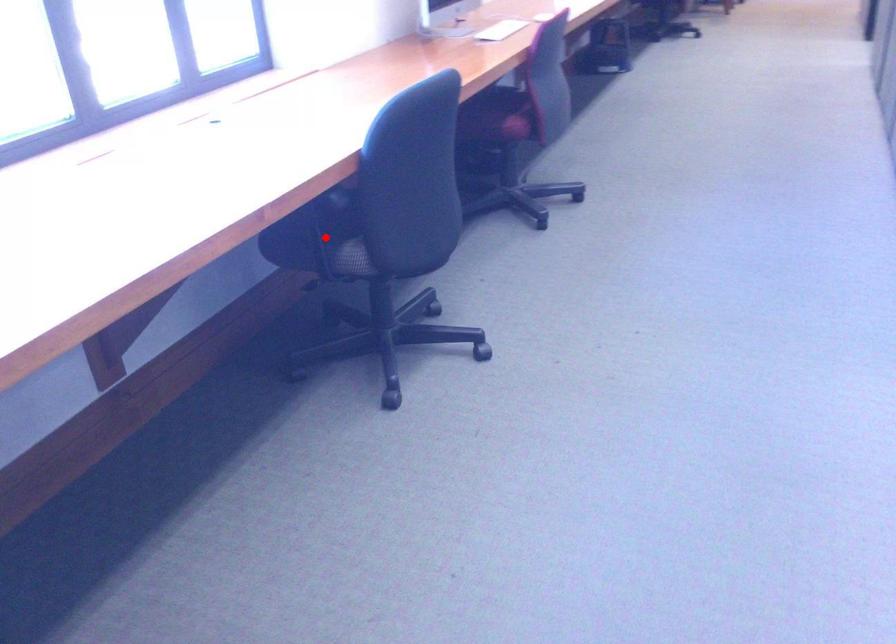
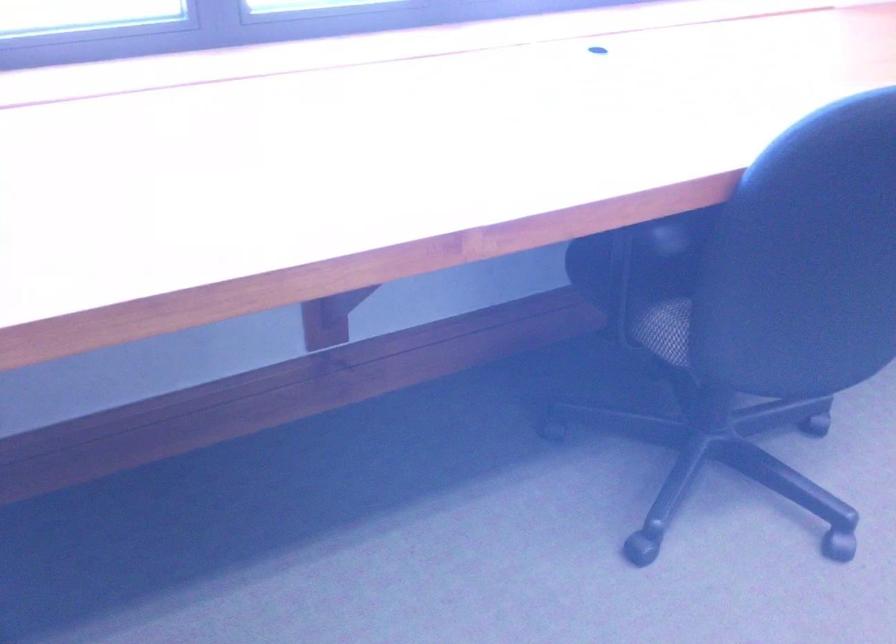
Locate, in the second image, the point that corresponds to the highlighted location in the first image.

(645, 279)